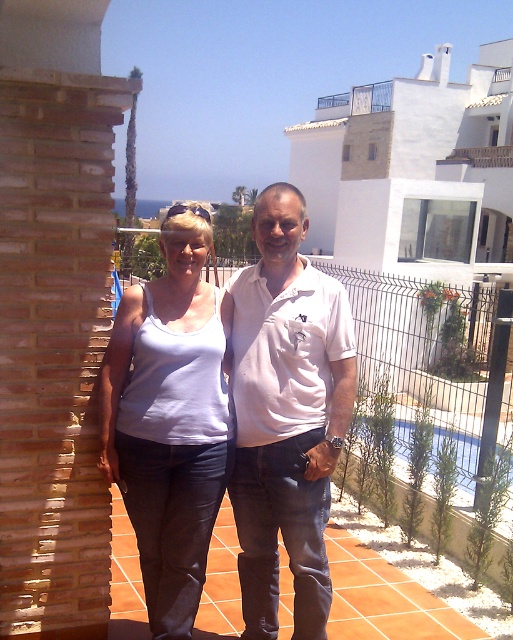
Question: Estimate the real-world distances between objects in this image. Which object is closer to the white matte tank top at center?

Choices:
 (A) white cotton polo shirt at center
 (B) white painted wood at upper right

Answer: (A)

Question: Is white matte tank top at center thinner than white painted wood at upper right?

Choices:
 (A) no
 (B) yes

Answer: (B)

Question: Does white matte tank top at center lie in front of white painted wood at upper right?

Choices:
 (A) yes
 (B) no

Answer: (A)

Question: Based on their relative distances, which object is farther from the white matte tank top at center?

Choices:
 (A) white cotton polo shirt at center
 (B) white painted wood at upper right

Answer: (B)

Question: Estimate the real-world distances between objects in this image. Which object is closer to the white cotton polo shirt at center?

Choices:
 (A) white painted wood at upper right
 (B) white matte tank top at center

Answer: (B)

Question: Can you confirm if white matte tank top at center is bigger than white painted wood at upper right?

Choices:
 (A) yes
 (B) no

Answer: (B)